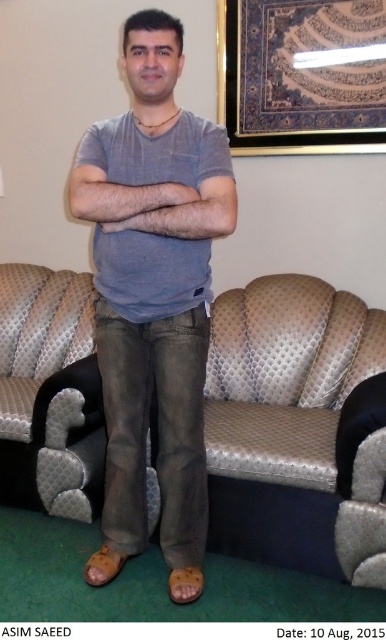
Can you confirm if matte gray t-shirt at center is thinner than matte gray shirt at center?

No, matte gray t-shirt at center is not thinner than matte gray shirt at center.

Does matte gray t-shirt at center have a smaller size compared to matte gray shirt at center?

No, matte gray t-shirt at center is not smaller than matte gray shirt at center.

Is point (120, 484) closer to camera compared to point (162, 196)?

No, (120, 484) is behind (162, 196).

Image resolution: width=386 pixels, height=640 pixels. In order to click on matte gray t-shirt at center in this screenshot , I will do `click(154, 298)`.

Is metallic leather couch at center in front of gold-framed picture at upper center?

Yes, it is.

Does metallic leather couch at center have a larger size compared to gold-framed picture at upper center?

Correct, metallic leather couch at center is larger in size than gold-framed picture at upper center.

The width and height of the screenshot is (386, 640). Find the location of `metallic leather couch at center`. metallic leather couch at center is located at coordinates (292, 428).

Find the location of a particular element. metallic leather couch at center is located at coordinates (292, 428).

How distant is gold-framed picture at upper center from matte gray shirt at center?

gold-framed picture at upper center and matte gray shirt at center are 1.14 meters apart.

Who is more forward, (238, 38) or (193, 193)?

Positioned in front is point (193, 193).

Where is `gold-framed picture at upper center`? gold-framed picture at upper center is located at coordinates (301, 76).